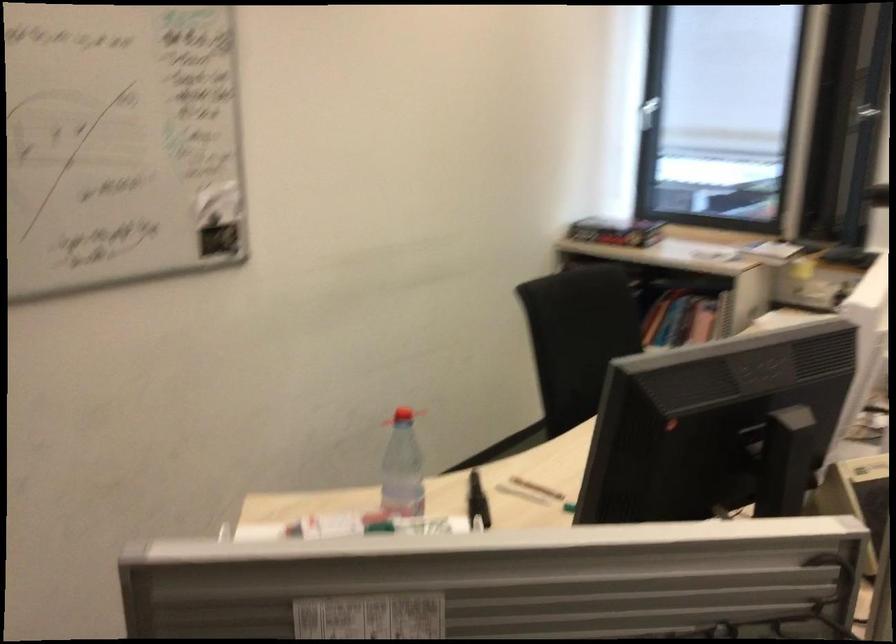
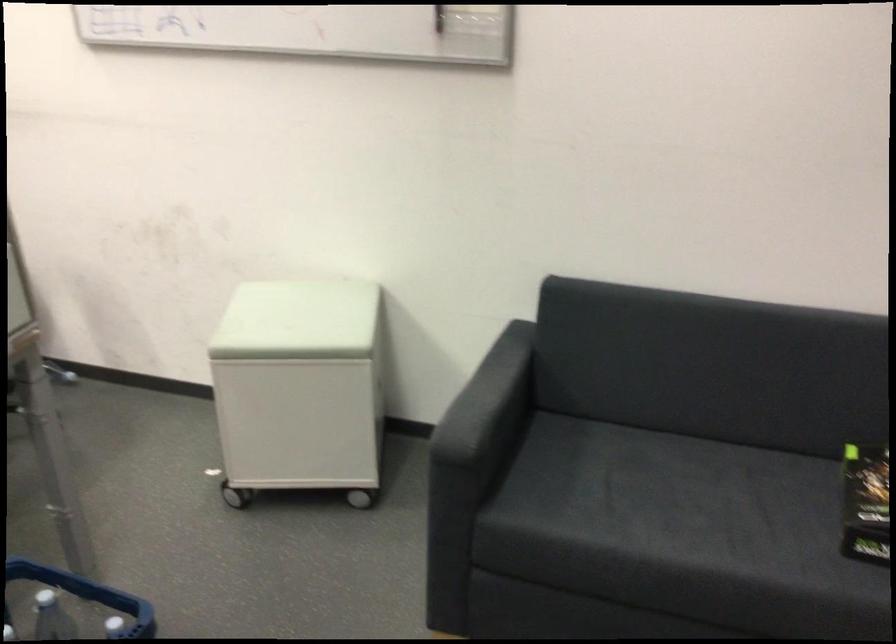
Based on the photo, based on the continuous images, in which direction is the camera rotating?

The rotation direction of the camera is right-down.